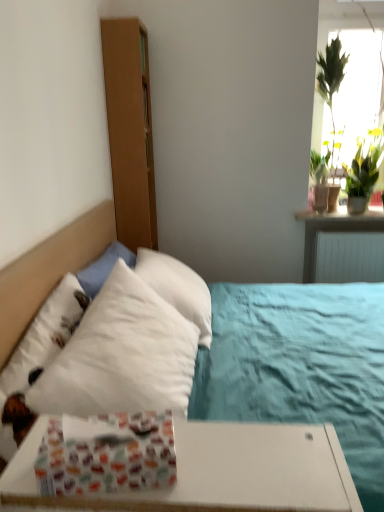
Question: Is white soft bed at left outside of patterned paper gift wrap at lower left?

Choices:
 (A) yes
 (B) no

Answer: (A)

Question: Is white soft bed at left closer to camera compared to patterned paper gift wrap at lower left?

Choices:
 (A) yes
 (B) no

Answer: (B)

Question: From a real-world perspective, is white soft bed at left positioned under patterned paper gift wrap at lower left based on gravity?

Choices:
 (A) yes
 (B) no

Answer: (A)

Question: Can you confirm if white soft bed at left is thinner than patterned paper gift wrap at lower left?

Choices:
 (A) yes
 (B) no

Answer: (B)

Question: Can you confirm if white soft bed at left is bigger than patterned paper gift wrap at lower left?

Choices:
 (A) no
 (B) yes

Answer: (B)

Question: Considering the relative sizes of white soft bed at left and patterned paper gift wrap at lower left in the image provided, is white soft bed at left wider than patterned paper gift wrap at lower left?

Choices:
 (A) no
 (B) yes

Answer: (B)

Question: Is patterned paper gift wrap at lower left further to the viewer compared to white soft bed at left?

Choices:
 (A) no
 (B) yes

Answer: (A)

Question: Considering the relative sizes of patterned paper gift wrap at lower left and white soft bed at left in the image provided, is patterned paper gift wrap at lower left taller than white soft bed at left?

Choices:
 (A) no
 (B) yes

Answer: (A)

Question: From the image's perspective, is patterned paper gift wrap at lower left located beneath white soft bed at left?

Choices:
 (A) no
 (B) yes

Answer: (B)

Question: Does patterned paper gift wrap at lower left have a lesser width compared to white soft bed at left?

Choices:
 (A) no
 (B) yes

Answer: (B)

Question: Is patterned paper gift wrap at lower left not inside white soft bed at left?

Choices:
 (A) no
 (B) yes

Answer: (B)

Question: Can you confirm if patterned paper gift wrap at lower left is wider than white soft bed at left?

Choices:
 (A) yes
 (B) no

Answer: (B)

Question: Visually, is patterned paper gift wrap at lower left positioned to the left or to the right of white soft bed at left?

Choices:
 (A) right
 (B) left

Answer: (A)